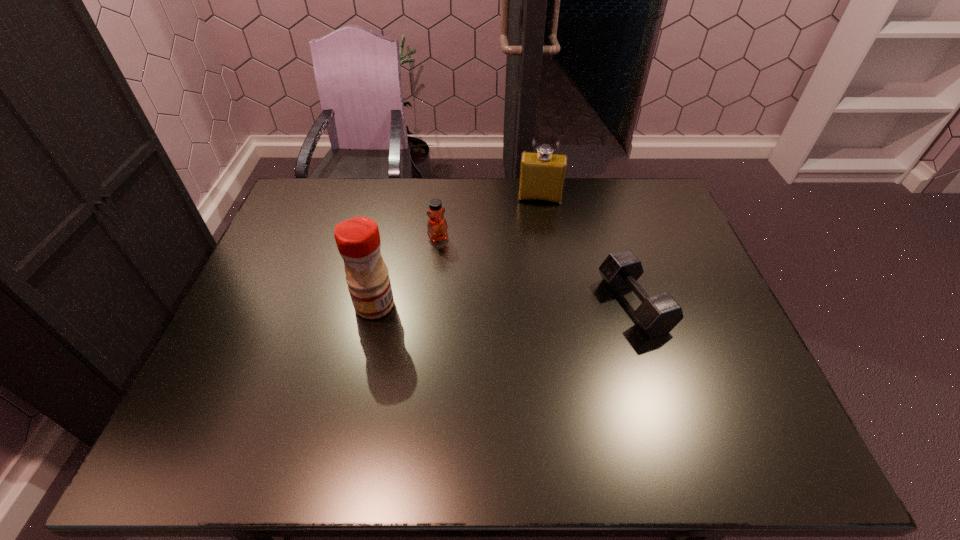
This screenshot has height=540, width=960. Identify the location of vacant area at the left edge of the desktop. (268, 296).

Image resolution: width=960 pixels, height=540 pixels. I want to click on free space at the right edge of the desktop, so click(674, 228).

At what (x,y) coordinates should I click in order to perform the action: click on vacant space at the far left corner of the desktop. Please return your answer as a coordinate pair (x, y). The height and width of the screenshot is (540, 960). Looking at the image, I should click on (306, 196).

Identify the location of vacant region at the far right corner of the desktop. (665, 207).

This screenshot has width=960, height=540. In order to click on vacant area that lies between the shortest object and the condiment in this screenshot , I will do `click(504, 305)`.

The height and width of the screenshot is (540, 960). I want to click on free point between the tallest object and the rightmost object, so click(x=504, y=305).

This screenshot has height=540, width=960. In order to click on vacant space in between the third object from right to left and the condiment in this screenshot , I will do `click(406, 272)`.

Locate an element on the screen. Image resolution: width=960 pixels, height=540 pixels. empty location between the condiment and the rightmost object is located at coordinates (504, 305).

Locate an element on the screen. This screenshot has width=960, height=540. vacant region between the third tallest object and the second tallest object is located at coordinates (489, 218).

Locate an element on the screen. The height and width of the screenshot is (540, 960). vacant area between the perfume and the condiment is located at coordinates (457, 252).